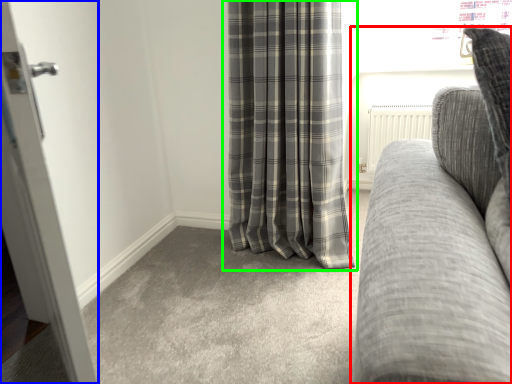
Question: Considering the real-world distances, which object is closest to studio couch (highlighted by a red box)? door (highlighted by a blue box) or curtain (highlighted by a green box).

Choices:
 (A) door
 (B) curtain

Answer: (A)